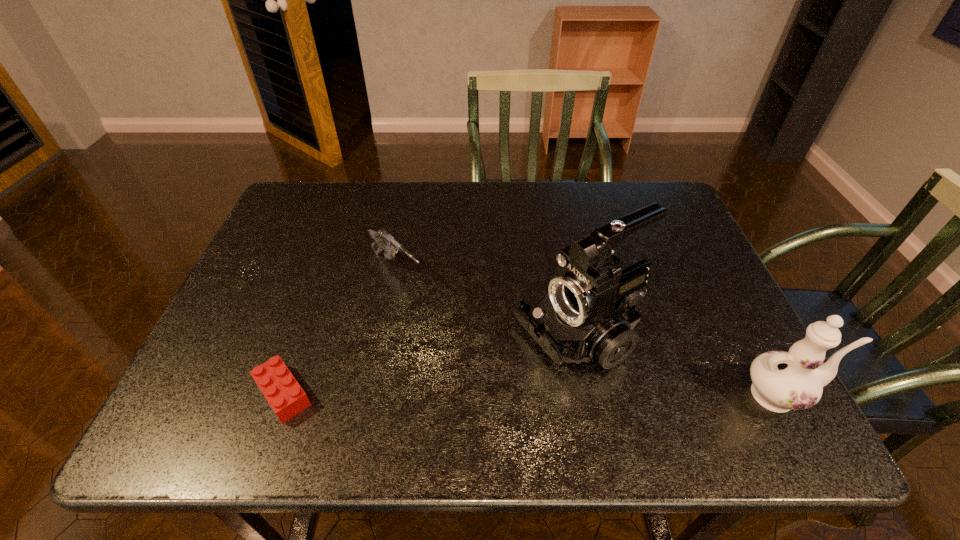
Find the location of a particular element. The width and height of the screenshot is (960, 540). free space that satisfies the following two spatial constraints: 1. on the front side of the gun; 2. on the right side of the tallest object is located at coordinates point(384,335).